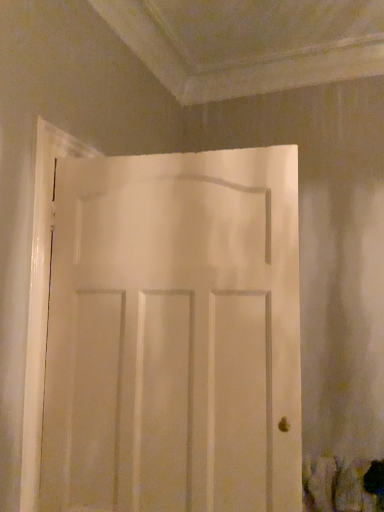
You are a GUI agent. You are given a task and a screenshot of the screen. Output one action in this format:
    pyautogui.click(x=<x>, y=<y>)
    Task: Click on the white matte door at center
    Image resolution: width=384 pixels, height=512 pixels.
    Given the screenshot: What is the action you would take?
    pyautogui.click(x=174, y=335)

What do you see at coordinates (174, 335) in the screenshot? This screenshot has width=384, height=512. I see `white matte door at center` at bounding box center [174, 335].

Image resolution: width=384 pixels, height=512 pixels. I want to click on white matte door at center, so click(174, 335).